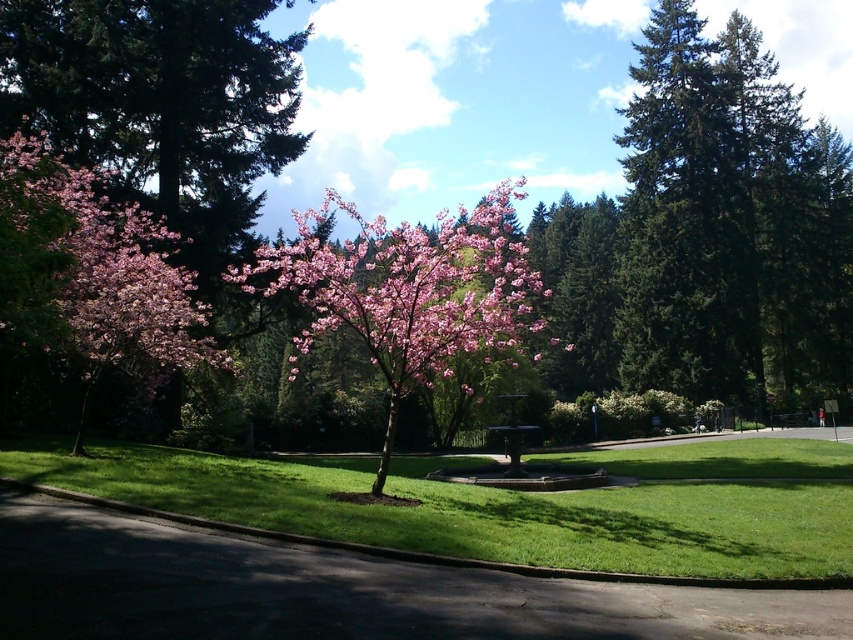
Question: Which of the following is the closest to the observer?

Choices:
 (A) click(141, 230)
 (B) click(390, 477)

Answer: (B)

Question: Is green grass at lower center smaller than pink matte flower at center?

Choices:
 (A) no
 (B) yes

Answer: (B)

Question: Which point is farther from the camera taking this photo?

Choices:
 (A) (93, 280)
 (B) (502, 349)
 (C) (635, 508)

Answer: (B)

Question: Is green grass at lower center to the left of pink matte flower at left from the viewer's perspective?

Choices:
 (A) no
 (B) yes

Answer: (A)

Question: Which point is farther to the camera?

Choices:
 (A) (79, 218)
 (B) (374, 358)
 (C) (705, 472)

Answer: (B)

Question: Is green grass at lower center in front of pink matte flower at left?

Choices:
 (A) yes
 (B) no

Answer: (B)